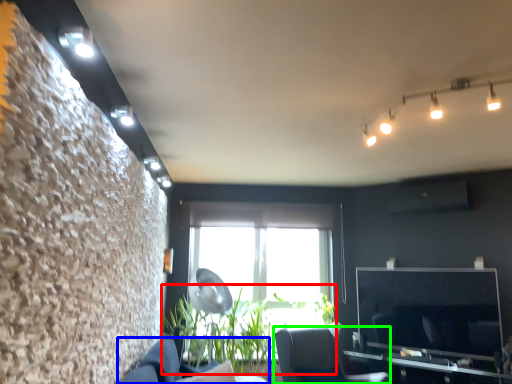
Question: Which object is the closest to the plant (highlighted by a red box)? Choose among these: couch (highlighted by a blue box) or furniture (highlighted by a green box).

Choices:
 (A) couch
 (B) furniture

Answer: (B)